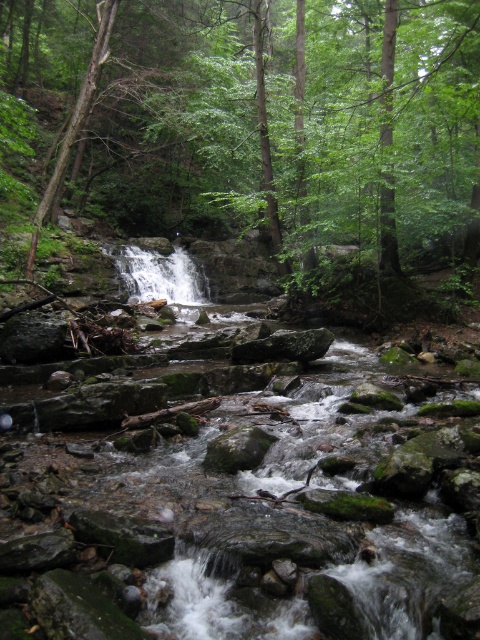
You are standing in the forest scene and want to walk from the point at coordinates point (253, 108) to the point at coordinates point (173, 250). Which direction should you move to get closer to your destination?

To move from point (253, 108) to point (173, 250), you should move towards the point (173, 250) by going in the direction of increasing x and decreasing y coordinates since point (173, 250) is closer to the camera than point (253, 108).

You are a hiker trying to cross the forest area. You see the green leafy tree at center and the white textured water at center. Which one do you think is bigger in size?

The green leafy tree at center is larger in size than the white textured water at center.

You are standing in the forest and see the green leafy tree at center and the white textured water at center. Which object is positioned to the left?

The white textured water at center is to the left of the green leafy tree at center.